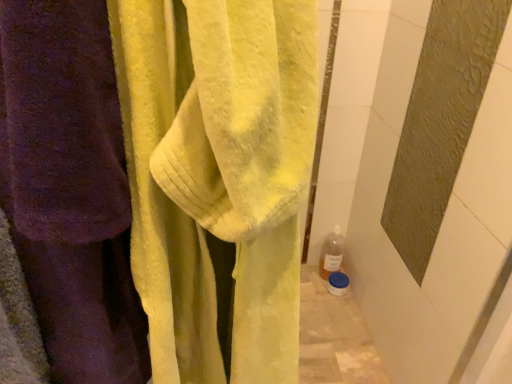
The height and width of the screenshot is (384, 512). What do you see at coordinates (331, 253) in the screenshot?
I see `translucent plastic bottle at lower right` at bounding box center [331, 253].

This screenshot has width=512, height=384. In order to click on translucent plastic bottle at lower right in this screenshot , I will do `click(331, 253)`.

You are a GUI agent. You are given a task and a screenshot of the screen. Output one action in this format:
    pyautogui.click(x=<x>, y=<y>)
    Task: Click on the translucent plastic bottle at lower right
    This screenshot has height=384, width=512.
    Given the screenshot: What is the action you would take?
    pyautogui.click(x=331, y=253)